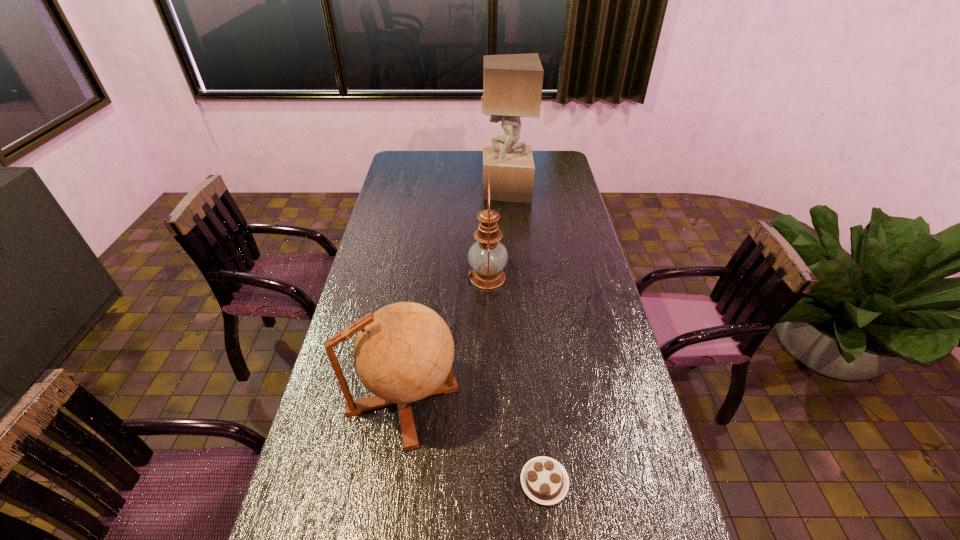
At what (x,y) coordinates should I click in order to perform the action: click on free space located 0.110m on the front of the oil lamp. Please return your answer as a coordinate pair (x, y). The height and width of the screenshot is (540, 960). Looking at the image, I should click on (489, 320).

The height and width of the screenshot is (540, 960). Find the location of `vacant region located 0.360m on the surface of the leftmost object`. vacant region located 0.360m on the surface of the leftmost object is located at coordinates (588, 399).

The width and height of the screenshot is (960, 540). I want to click on vacant space located 0.110m on the right of the nearest object, so click(614, 482).

Find the location of a particular element. The height and width of the screenshot is (540, 960). object situated at the left edge is located at coordinates (404, 352).

At what (x,y) coordinates should I click in order to perform the action: click on free location at the far edge of the desktop. Please return your answer as a coordinate pair (x, y). Looking at the image, I should click on (458, 156).

Where is `free space at the left edge of the desktop`? The height and width of the screenshot is (540, 960). free space at the left edge of the desktop is located at coordinates (331, 447).

Identify the location of vacant region at the right edge. The image size is (960, 540). (561, 247).

At what (x,y) coordinates should I click in order to perform the action: click on empty space between the globe and the nearest object. Please return your answer as a coordinate pair (x, y). Looking at the image, I should click on (473, 440).

Find the location of `vacant space in between the second nearest object and the nearest object`. vacant space in between the second nearest object and the nearest object is located at coordinates (473, 440).

Identify the location of free spot between the chocolate cake and the tallest object. (525, 336).